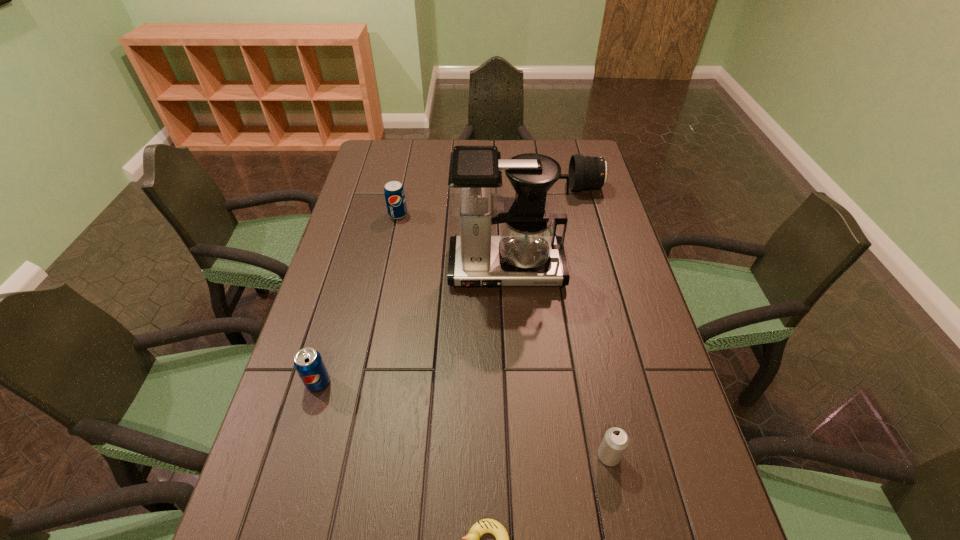
Where is `vacant space at the left edge of the desktop`? This screenshot has width=960, height=540. vacant space at the left edge of the desktop is located at coordinates (333, 265).

What are the coordinates of `blank space at the right edge` in the screenshot? It's located at (565, 204).

In order to click on vacant space at the far right corner of the desktop in this screenshot , I will do `click(555, 140)`.

Locate an element on the screen. vacant area that lies between the tallest object and the fifth tallest object is located at coordinates (558, 362).

Locate an element on the screen. This screenshot has height=540, width=960. free spot between the farthest object and the beer can is located at coordinates (597, 322).

Where is `free area in between the fourth nearest object and the left pop soda`? free area in between the fourth nearest object and the left pop soda is located at coordinates (412, 326).

The width and height of the screenshot is (960, 540). What are the coordinates of `free space that is in between the fifth tallest object and the rightmost object` in the screenshot? It's located at (597, 322).

The width and height of the screenshot is (960, 540). Find the location of `empty location between the fourth farthest object and the third farthest object`. empty location between the fourth farthest object and the third farthest object is located at coordinates click(x=412, y=326).

At what (x,y) coordinates should I click in order to perform the action: click on free space between the coffee maker and the leftmost object. Please return your answer as a coordinate pair (x, y). Image resolution: width=960 pixels, height=540 pixels. Looking at the image, I should click on (412, 326).

Image resolution: width=960 pixels, height=540 pixels. Find the location of `free point between the farther pop soda and the nearer pop soda`. free point between the farther pop soda and the nearer pop soda is located at coordinates (358, 299).